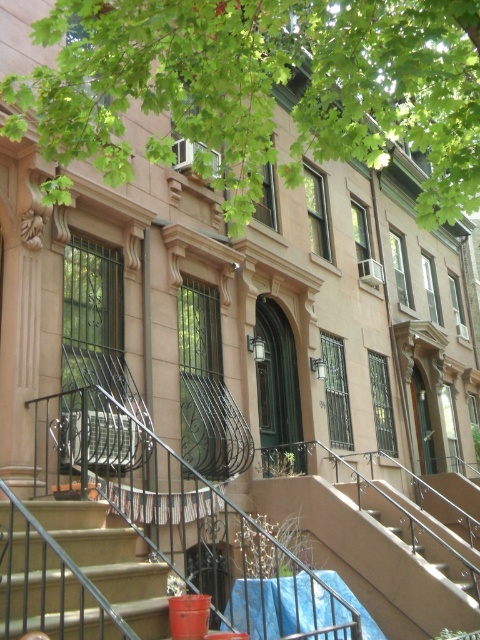
The height and width of the screenshot is (640, 480). What are the coordinates of `green leafy tree at upper center` in the screenshot? It's located at (264, 86).

Is green leafy tree at upper center bigger than smooth concrete stairs at center?

Yes.

Find the location of a particular element. green leafy tree at upper center is located at coordinates (264, 86).